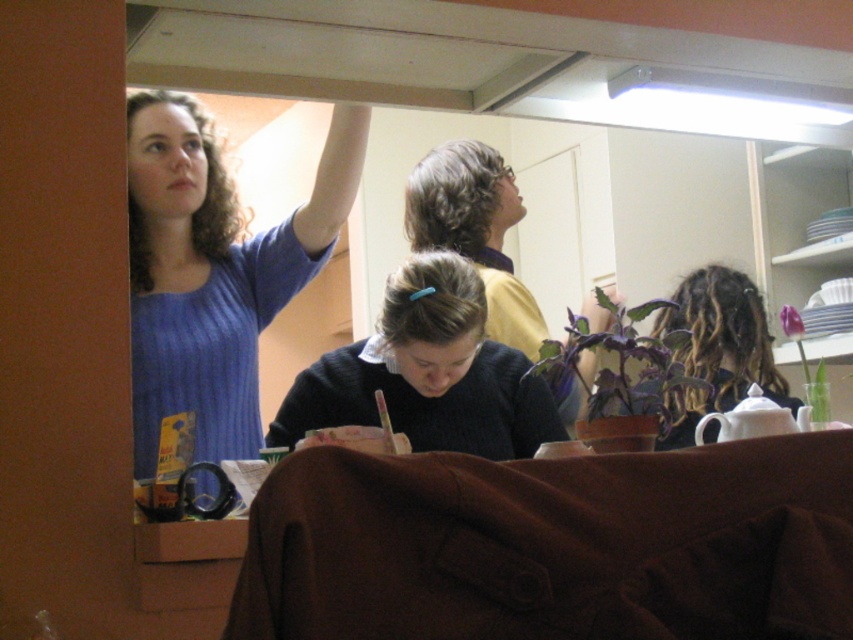
Does dark blue sweater at center have a smaller size compared to dark brown dreadlocks at upper right?

Yes, dark blue sweater at center is smaller than dark brown dreadlocks at upper right.

Who is lower down, dark blue sweater at center or dark brown dreadlocks at upper right?

dark blue sweater at center is lower down.

Does point (320, 384) come in front of point (735, 326)?

Yes, it is.

I want to click on dark blue sweater at center, so click(427, 372).

From the picture: Who is positioned more to the right, black sweater at center or dark brown dreadlocks at upper right?

dark brown dreadlocks at upper right is more to the right.

Locate an element on the screen. The height and width of the screenshot is (640, 853). black sweater at center is located at coordinates (474, 230).

Where is `black sweater at center`? The image size is (853, 640). black sweater at center is located at coordinates (474, 230).

Does blue ribbed sweater at upper left come behind dark brown dreadlocks at upper right?

No, blue ribbed sweater at upper left is in front of dark brown dreadlocks at upper right.

Is blue ribbed sweater at upper left above dark brown dreadlocks at upper right?

Indeed, blue ribbed sweater at upper left is positioned over dark brown dreadlocks at upper right.

Between point (242, 259) and point (676, 358), which one is positioned behind?

The point (676, 358) is more distant.

The width and height of the screenshot is (853, 640). I want to click on blue ribbed sweater at upper left, so click(x=213, y=273).